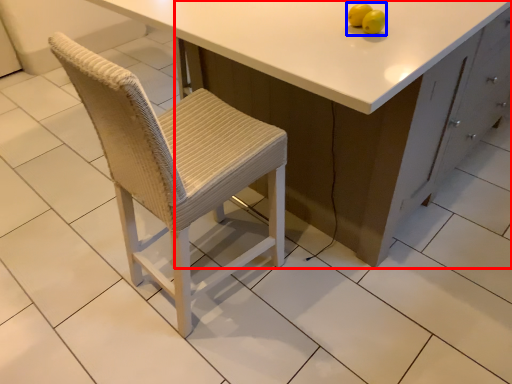
Question: Which object appears closest to the camera in this image, cabinetry (highlighted by a red box) or fruit (highlighted by a blue box)?

Choices:
 (A) cabinetry
 (B) fruit

Answer: (A)